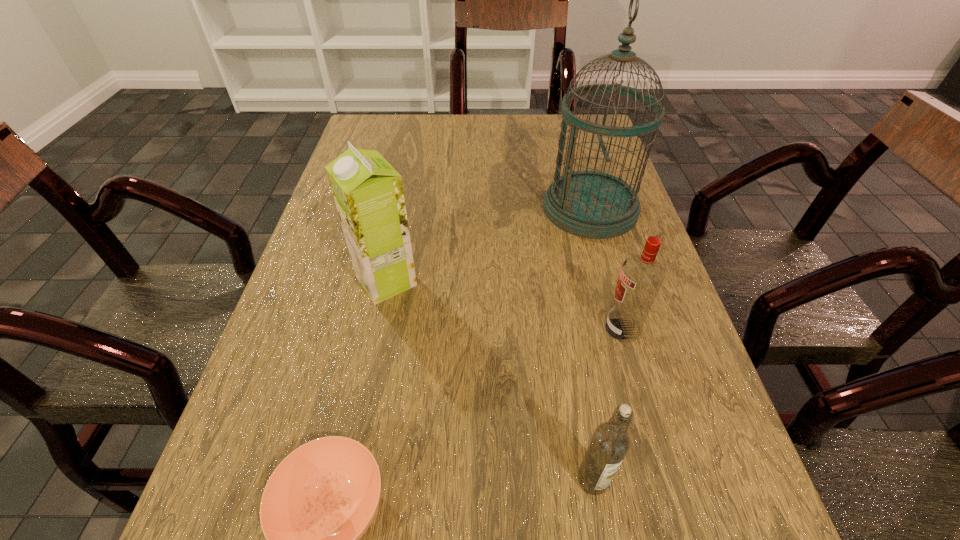
In order to click on the tallest object in this screenshot , I will do `click(591, 204)`.

Where is `birdcage`? The width and height of the screenshot is (960, 540). birdcage is located at coordinates (591, 204).

Locate an element on the screen. the fourth shortest object is located at coordinates (368, 192).

Identify the location of soya milk. Image resolution: width=960 pixels, height=540 pixels. (368, 192).

At what (x,y) coordinates should I click in order to perform the action: click on the farther vodka. Please return your answer as a coordinate pair (x, y). Looking at the image, I should click on (641, 276).

Identify the location of the third nearest object. (641, 276).

You are a GUI agent. You are given a task and a screenshot of the screen. Output one action in this format:
    pyautogui.click(x=<x>, y=<y>)
    Task: Click on the left vodka
    
    Given the screenshot: What is the action you would take?
    pyautogui.click(x=610, y=442)

Locate an element on the screen. The width and height of the screenshot is (960, 540). free space located on the front-facing side of the tallest object is located at coordinates (422, 208).

The height and width of the screenshot is (540, 960). Find the location of `vacant area situated 0.290m on the front-facing side of the tallest object`. vacant area situated 0.290m on the front-facing side of the tallest object is located at coordinates (422, 208).

The height and width of the screenshot is (540, 960). I want to click on vacant space located on the front-facing side of the tallest object, so click(x=518, y=208).